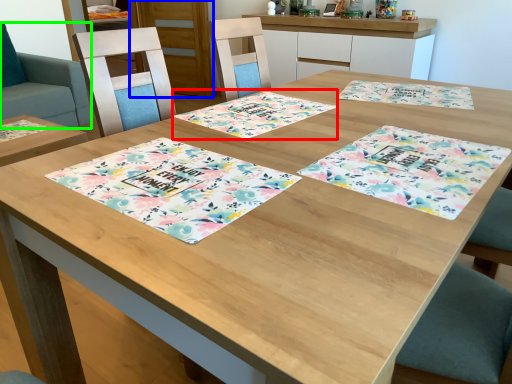
Question: Which object is the farthest from place mat (highlighted by a red box)? Choose among these: cabinetry (highlighted by a blue box) or swivel chair (highlighted by a green box).

Choices:
 (A) cabinetry
 (B) swivel chair

Answer: (A)